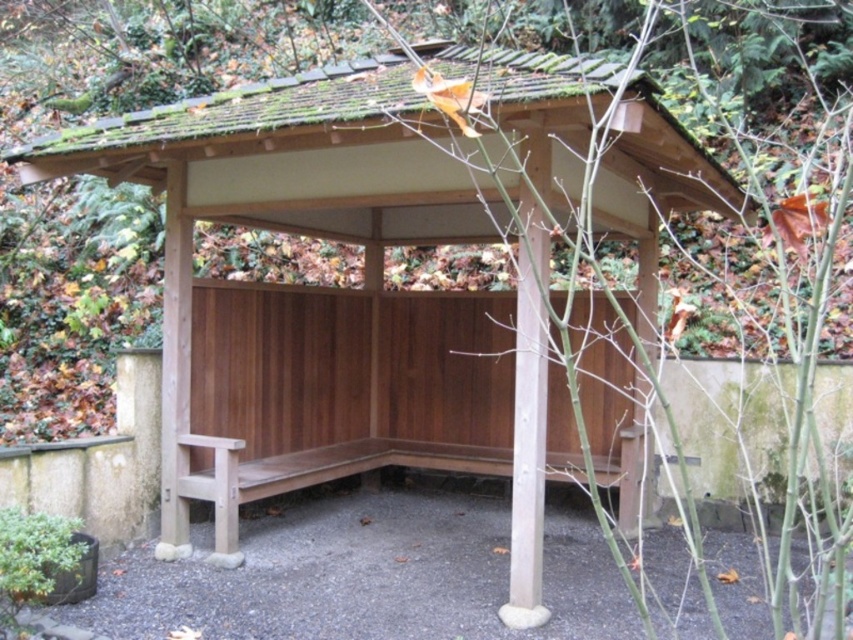
Question: Which point is farther to the camera?

Choices:
 (A) (564, 420)
 (B) (332, 477)

Answer: (A)

Question: Can you confirm if wooden bench at center is positioned to the left of wooden bench at lower left?

Choices:
 (A) yes
 (B) no

Answer: (B)

Question: Does wooden bench at center have a lesser width compared to wooden bench at lower left?

Choices:
 (A) no
 (B) yes

Answer: (A)

Question: Is wooden bench at center to the left of wooden bench at lower left from the viewer's perspective?

Choices:
 (A) no
 (B) yes

Answer: (A)

Question: Which point appears farthest from the camera in this image?

Choices:
 (A) (660, 179)
 (B) (492, 451)

Answer: (B)

Question: Which of the following is the closest to the observer?

Choices:
 (A) wooden bench at lower left
 (B) wooden bench at center

Answer: (B)